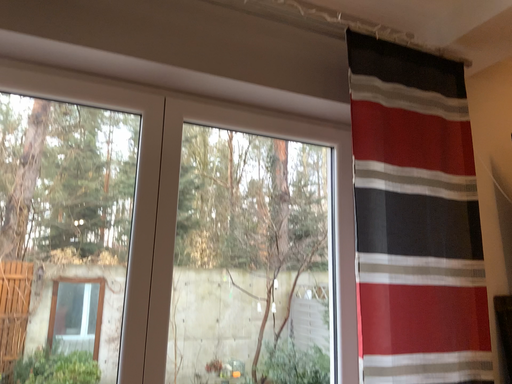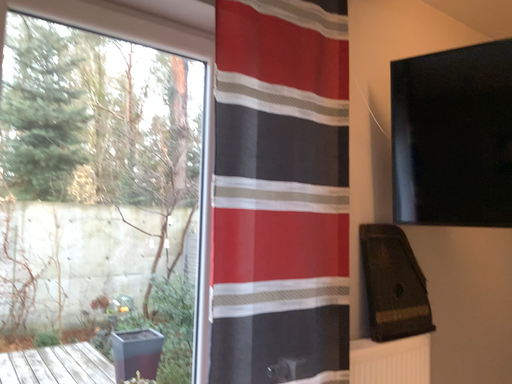
Question: Which way did the camera rotate in the video?

Choices:
 (A) rotated downward
 (B) rotated upward

Answer: (A)